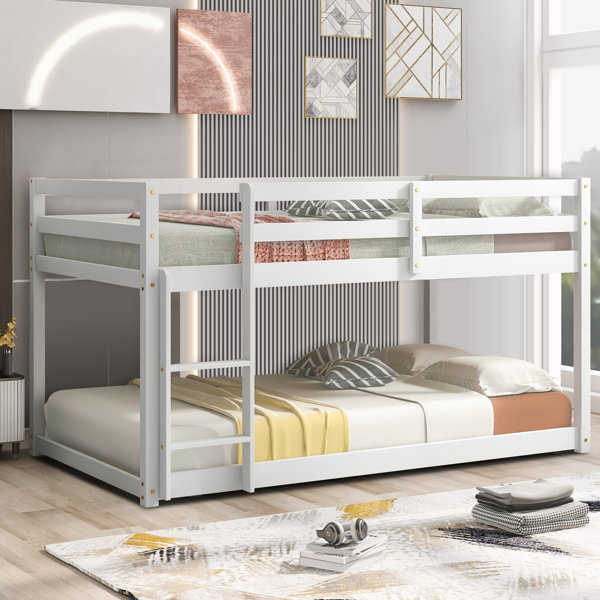
I want to click on pictures on wall, so click(455, 41), click(362, 13), click(331, 93), click(205, 80).